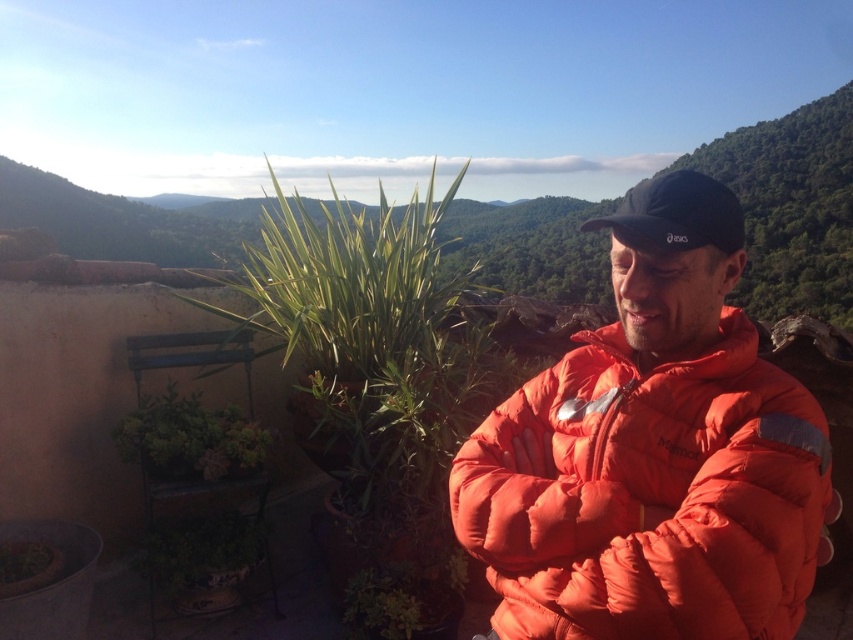
You are a photographer trying to capture a photo of the orange down jacket at center and the green succulent at lower left. Which object should you adjust your camera focus to first if you want to include both in the frame?

The green succulent at lower left should be focused on first since it is positioned to the left of the orange down jacket at center, allowing you to adjust the camera to include both in the frame.

You are a delivery drone carrying a package to the orange down jacket at center. Your GPS shows the green succulent at lower left is directly below your current position. Is the jacket within your delivery range if your maximum drop height is 2 meters?

The orange down jacket at center is located above the green succulent at lower left. Since the drone is directly above the green succulent at lower left, the jacket is higher than the drone, so it may not be within the delivery range unless the drone can ascend further.